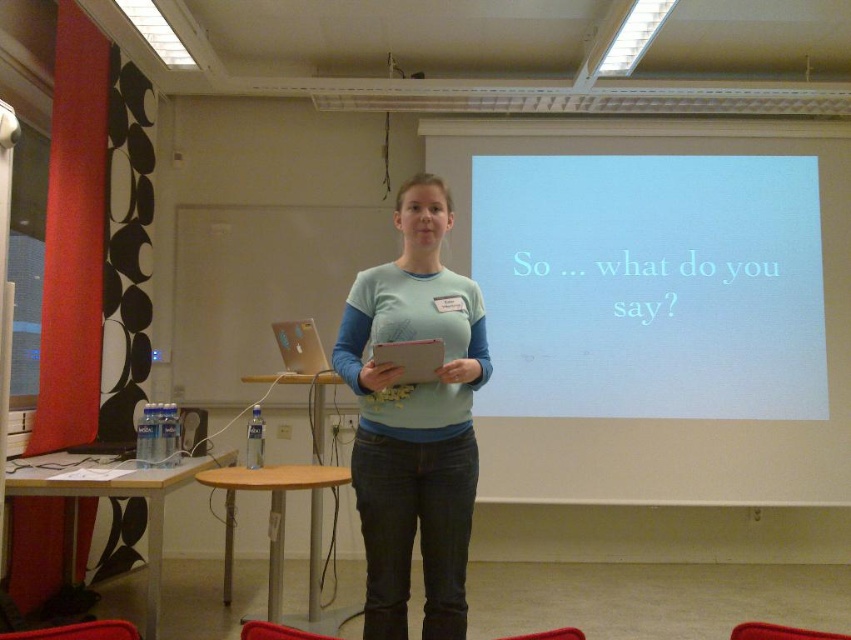
Question: Which of the following is the farthest from the observer?

Choices:
 (A) white matte projection screen at upper center
 (B) light blue cotton shirt at center

Answer: (A)

Question: Is white matte projection screen at upper center above light blue cotton shirt at center?

Choices:
 (A) no
 (B) yes

Answer: (B)

Question: Which point is closer to the camera?

Choices:
 (A) (546, 196)
 (B) (384, 307)

Answer: (B)

Question: Observing the image, what is the correct spatial positioning of white matte projection screen at upper center in reference to light blue cotton shirt at center?

Choices:
 (A) above
 (B) below

Answer: (A)

Question: Does white matte projection screen at upper center lie behind light blue cotton shirt at center?

Choices:
 (A) yes
 (B) no

Answer: (A)